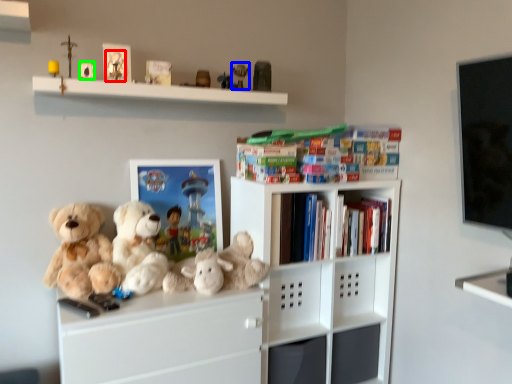
Question: Estimate the real-world distances between objects in this image. Which object is farther from toy (highlighted by a red box), toy (highlighted by a blue box) or toy (highlighted by a green box)?

Choices:
 (A) toy
 (B) toy

Answer: (A)